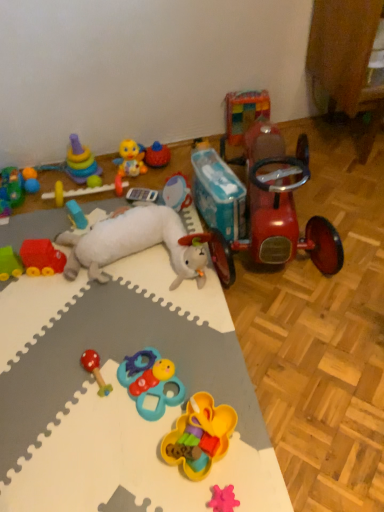
The image size is (384, 512). I want to click on vacant space that's between pink rubber bear at lower center, which is the 11th toy in left-to-right order, and rubberized yellow flower-shaped toy at center, the 4th toy from the right, so click(226, 467).